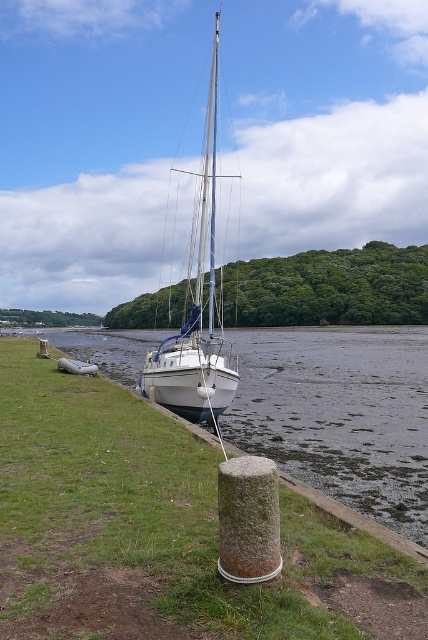
Question: Among these objects, which one is farthest from the camera?

Choices:
 (A) green grass at lower left
 (B) green mossy stone pillar at lower center
 (C) white glossy sailboat at center

Answer: (C)

Question: Which point is farther from the camera taking this photo?

Choices:
 (A) pyautogui.click(x=214, y=365)
 (B) pyautogui.click(x=250, y=481)
 (C) pyautogui.click(x=163, y=548)

Answer: (A)

Question: Does white glossy sailboat at center appear on the right side of green mossy stone pillar at lower center?

Choices:
 (A) yes
 (B) no

Answer: (A)

Question: Which object is closer to the camera taking this photo?

Choices:
 (A) green grass at lower left
 (B) white glossy sailboat at center

Answer: (A)

Question: Does green grass at lower left appear on the left side of white glossy sailboat at center?

Choices:
 (A) yes
 (B) no

Answer: (A)

Question: Can you confirm if green grass at lower left is bigger than green mossy stone pillar at lower center?

Choices:
 (A) yes
 (B) no

Answer: (A)